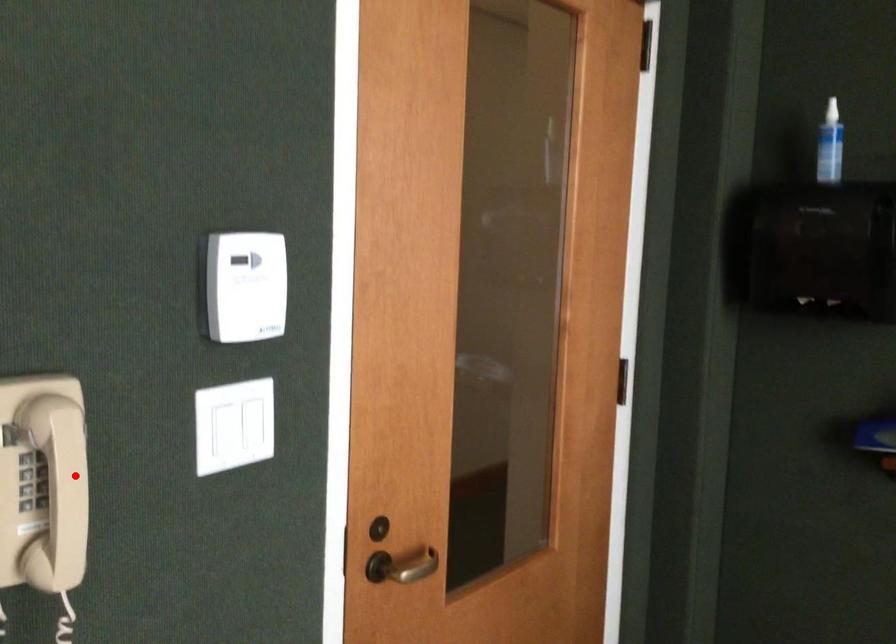
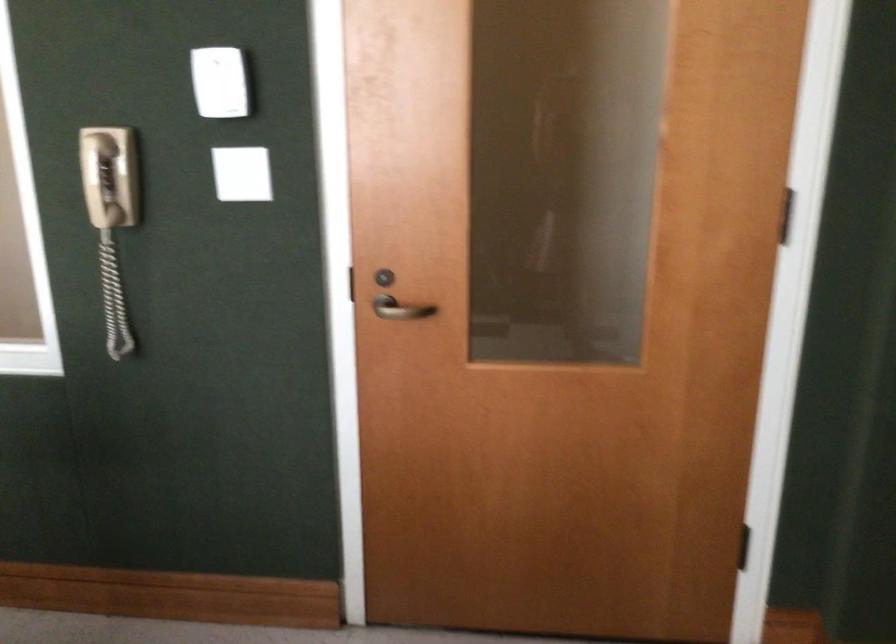
The point at the highlighted location is marked in the first image. Where is the corresponding point in the second image?

(99, 180)